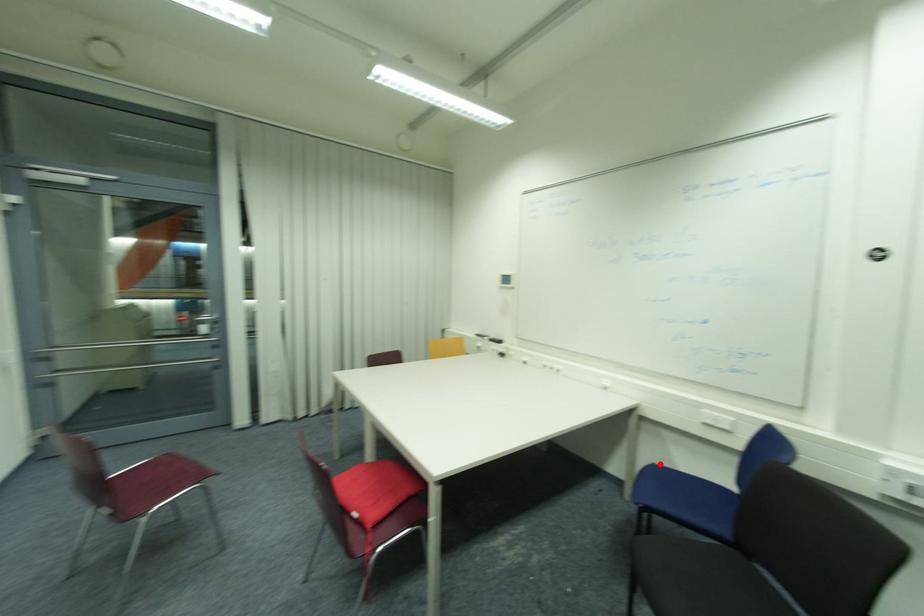
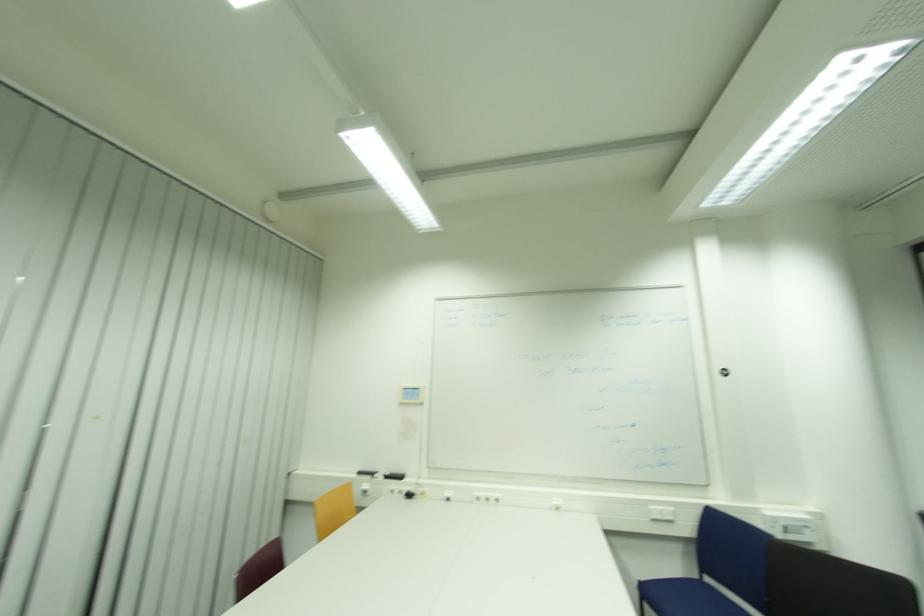
Question: I am providing you with two images of the same scene from different viewpoints. A red point is marked on the first image. At the location where the point appears in image 1, is it still visible in image 2?

Choices:
 (A) Yes
 (B) No

Answer: (A)